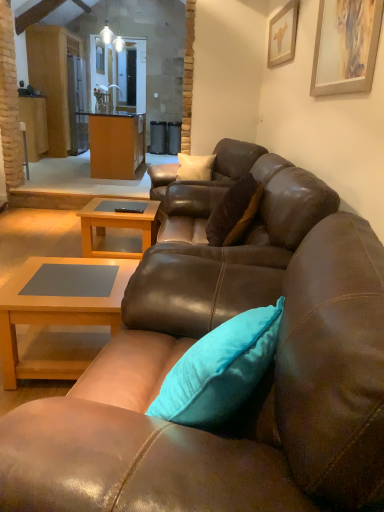
Question: From the image's perspective, would you say matte wood cabinet at center is positioned over wooden picture frame at upper right, which is the 1th picture frame from front to back?

Choices:
 (A) yes
 (B) no

Answer: (A)

Question: Is matte wood cabinet at center next to wooden picture frame at upper right, the 1th picture frame positioned from the bottom, and touching it?

Choices:
 (A) no
 (B) yes

Answer: (A)

Question: Can you confirm if matte wood cabinet at center is wider than wooden picture frame at upper right, which is the 1th picture frame from front to back?

Choices:
 (A) yes
 (B) no

Answer: (A)

Question: Considering the relative positions of matte wood cabinet at center and wooden picture frame at upper right, which is the 1th picture frame from front to back, in the image provided, is matte wood cabinet at center to the right of wooden picture frame at upper right, which is the 1th picture frame from front to back, from the viewer's perspective?

Choices:
 (A) yes
 (B) no

Answer: (B)

Question: Is matte wood cabinet at center in front of wooden picture frame at upper right, the 1th picture frame positioned from the bottom?

Choices:
 (A) no
 (B) yes

Answer: (A)

Question: In the image, is brown leather couch at center, the 2th studio couch in the bottom-to-top sequence, positioned in front of or behind brown leather swivel chair at center?

Choices:
 (A) front
 (B) behind

Answer: (B)

Question: Is brown leather couch at center, the 2th studio couch in the bottom-to-top sequence, taller or shorter than brown leather swivel chair at center?

Choices:
 (A) tall
 (B) short

Answer: (B)

Question: Considering the positions of brown leather couch at center, arranged as the first studio couch when viewed from the top, and brown leather swivel chair at center in the image, is brown leather couch at center, arranged as the first studio couch when viewed from the top, bigger or smaller than brown leather swivel chair at center?

Choices:
 (A) big
 (B) small

Answer: (B)

Question: Considering the positions of point (213, 172) and point (236, 157), is point (213, 172) closer or farther from the camera than point (236, 157)?

Choices:
 (A) farther
 (B) closer

Answer: (A)

Question: Is light brown wood coffee table at center, which is counted as the 1th coffee table, starting from the top, wider or thinner than brown leather couch at center, the second studio couch viewed from the front?

Choices:
 (A) wide
 (B) thin

Answer: (B)

Question: Would you say light brown wood coffee table at center, which is the second coffee table in bottom-to-top order, is to the left or to the right of brown leather couch at center, the 2th studio couch in the bottom-to-top sequence, in the picture?

Choices:
 (A) right
 (B) left

Answer: (B)

Question: Is light brown wood coffee table at center, which is counted as the 1th coffee table, starting from the top, in front of or behind brown leather couch at center, which ranks as the 1th studio couch in back-to-front order, in the image?

Choices:
 (A) front
 (B) behind

Answer: (A)

Question: Is point (144, 242) closer or farther from the camera than point (155, 181)?

Choices:
 (A) closer
 (B) farther

Answer: (A)

Question: Based on their positions, is brown leather couch at center, positioned as the 2th studio couch in back-to-front order, located to the left or right of matte wood cabinet at center?

Choices:
 (A) right
 (B) left

Answer: (A)

Question: Is brown leather couch at center, which appears as the 1th studio couch when viewed from the front, bigger or smaller than matte wood cabinet at center?

Choices:
 (A) small
 (B) big

Answer: (A)